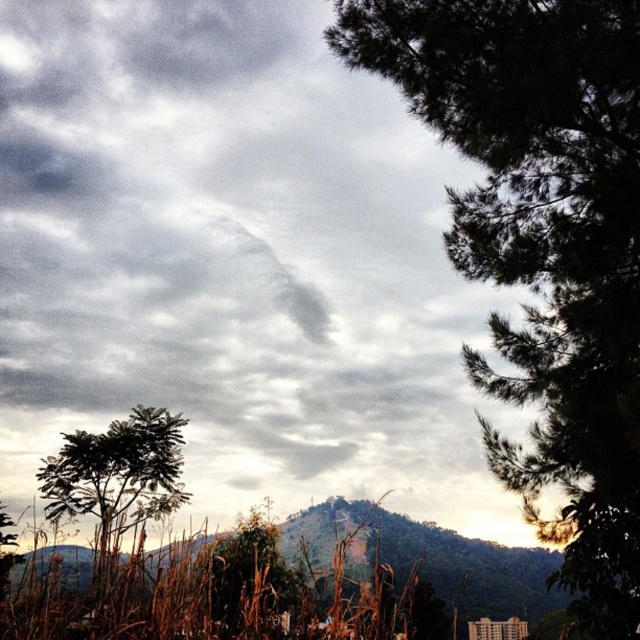
Question: In this image, where is dark green textured tree at right located relative to green matte tree at lower center?

Choices:
 (A) left
 (B) right

Answer: (B)

Question: Does dark green textured tree at right lie in front of green textured hill at center?

Choices:
 (A) yes
 (B) no

Answer: (A)

Question: Considering the relative positions of dark green textured tree at right and green leafy tree at lower left in the image provided, where is dark green textured tree at right located with respect to green leafy tree at lower left?

Choices:
 (A) above
 (B) below

Answer: (A)

Question: Which of the following is the farthest from the observer?

Choices:
 (A) (90, 512)
 (B) (292, 593)

Answer: (A)

Question: Which of these objects is positioned closest to the dark green textured tree at right?

Choices:
 (A) green matte tree at lower center
 (B) green leafy tree at lower left
 (C) green textured hill at center

Answer: (C)

Question: Estimate the real-world distances between objects in this image. Which object is farther from the green matte tree at lower center?

Choices:
 (A) dark green textured tree at right
 (B) green textured hill at center
 (C) green leafy tree at lower left

Answer: (A)